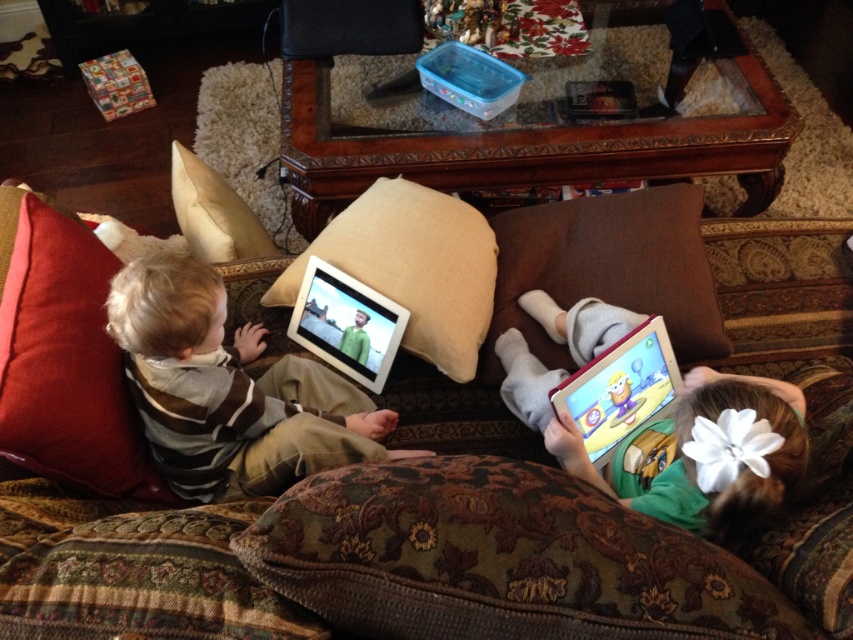
You are a child who wants to place a small toy between the brown fabric pillow at right and the beige fabric pillow at center. The toy is 8 inches long. Will it fit without overlapping either pillow?

The distance between the brown fabric pillow at right and the beige fabric pillow at center is 9.09 inches. Since the toy is 8 inches long, it will fit within the space without overlapping either pillow.

You are a parent trying to hand a toy to your child. You see the matte white tablet at center and the matte plastic tablet at lower right. Which tablet is closer to the left side of the couch?

The matte white tablet at center is closer to the left side of the couch because it is positioned to the left of the matte plastic tablet at lower right.